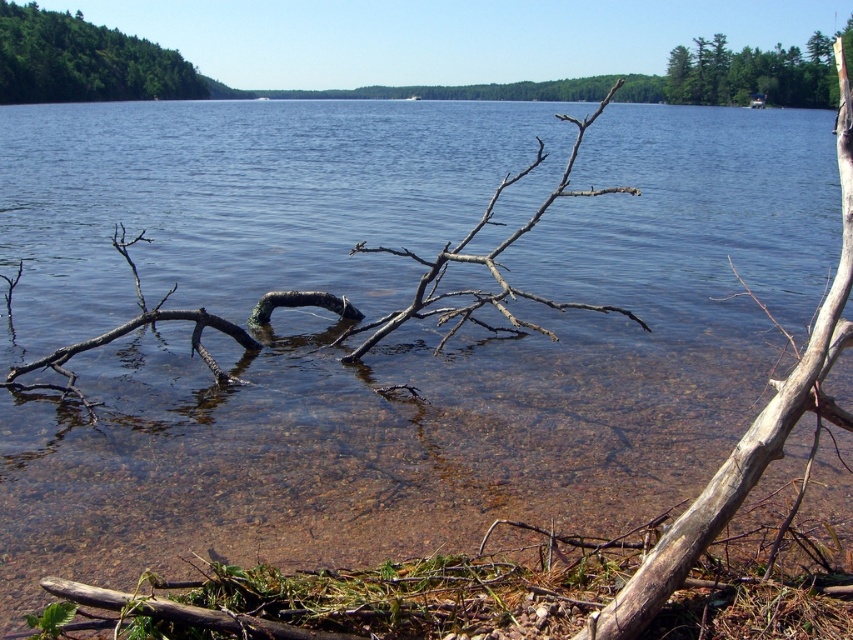
Question: Which point is closer to the camera?

Choices:
 (A) (367, 346)
 (B) (740, 77)

Answer: (A)

Question: Estimate the real-world distances between objects in this image. Which object is farther from the green leafy tree at upper right?

Choices:
 (A) brown rough branch at center
 (B) green leafy tree at upper left

Answer: (A)

Question: Is brown rough branch at center above green leafy tree at upper left?

Choices:
 (A) yes
 (B) no

Answer: (B)

Question: Which point is farther to the camera?

Choices:
 (A) brown rough branch at center
 (B) green leafy tree at upper right

Answer: (B)

Question: Is brown rough branch at center thinner than green leafy tree at upper left?

Choices:
 (A) no
 (B) yes

Answer: (B)

Question: Is brown rough branch at center smaller than green leafy tree at upper left?

Choices:
 (A) yes
 (B) no

Answer: (A)